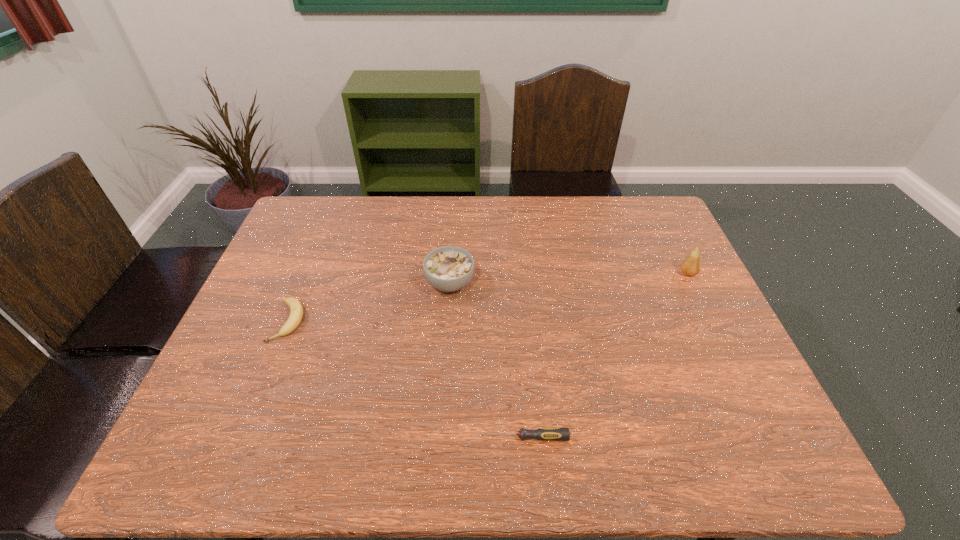
At what (x,y) coordinates should I click in order to perform the action: click on vacant space in between the second object from left to right and the third object from left to right. Please return your answer as a coordinate pair (x, y). The height and width of the screenshot is (540, 960). Looking at the image, I should click on (487, 360).

Select which object appears as the closest to the nearest object. Please provide its 2D coordinates. Your answer should be formatted as a tuple, i.e. [(x, y)], where the tuple contains the x and y coordinates of a point satisfying the conditions above.

[(448, 269)]

Find the location of a particular element. This screenshot has height=540, width=960. object that is the closest one to the leftmost object is located at coordinates (448, 269).

You are a GUI agent. You are given a task and a screenshot of the screen. Output one action in this format:
    pyautogui.click(x=<x>, y=<y>)
    Task: Click on the vacant space that satisfies the following two spatial constraints: 1. on the front side of the pear; 2. insert the third object from left to right into a screw head
    
    Given the screenshot: What is the action you would take?
    pyautogui.click(x=769, y=437)